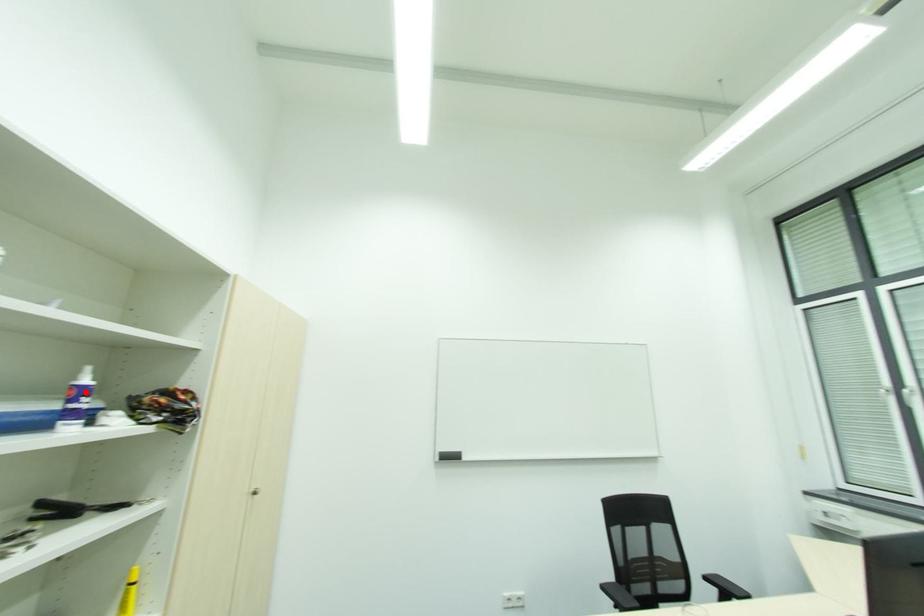
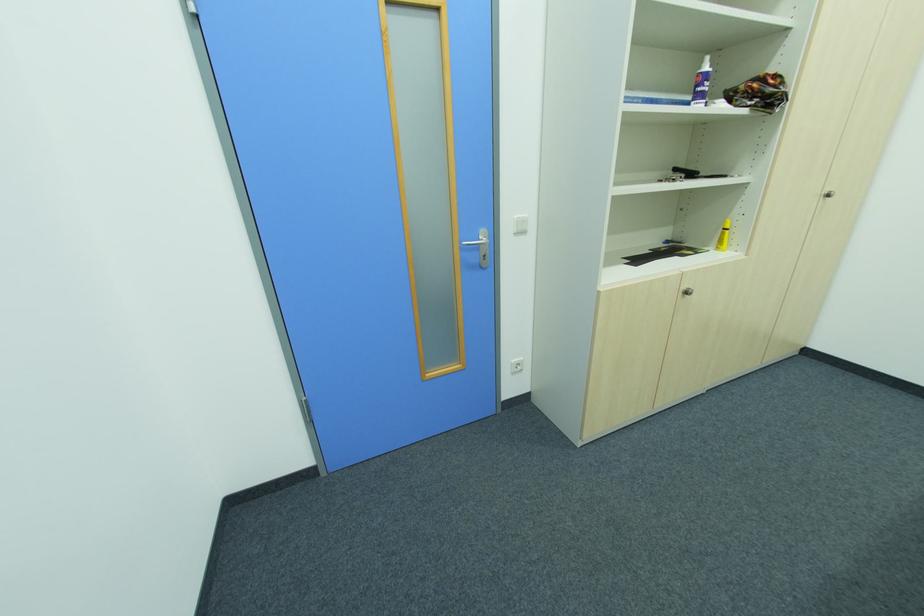
Locate, in the second image, the point that corresponds to the highlighted location in the first image.

(708, 78)